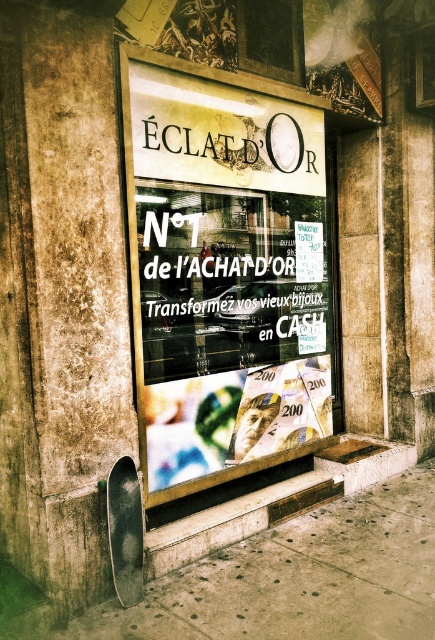
You are a GUI agent. You are given a task and a screenshot of the screen. Output one action in this format:
    pyautogui.click(x=<x>, y=<y>)
    Task: Click on the smooth concrete pavement at lower left
    
    Given the screenshot: What is the action you would take?
    pyautogui.click(x=301, y=577)

Consider the image. Who is more distant from viewer, [236,563] or [271,336]?

The point [271,336] is more distant.

I want to click on smooth concrete pavement at lower left, so pyautogui.click(x=301, y=577).

Which is more to the left, matte glass shop window at center or white paper at center?

From the viewer's perspective, matte glass shop window at center appears more on the left side.

The width and height of the screenshot is (435, 640). Describe the element at coordinates (220, 268) in the screenshot. I see `matte glass shop window at center` at that location.

Locate an element on the screen. matte glass shop window at center is located at coordinates (220, 268).

Does smooth concrete pavement at lower left appear over metallic gray skateboard at lower left?

No.

Can you confirm if smooth concrete pavement at lower left is positioned to the right of metallic gray skateboard at lower left?

Yes, smooth concrete pavement at lower left is to the right of metallic gray skateboard at lower left.

Measure the distance between point (345, 618) and camera.

Point (345, 618) is 2.90 meters away from camera.

Locate an element on the screen. The image size is (435, 640). smooth concrete pavement at lower left is located at coordinates (301, 577).